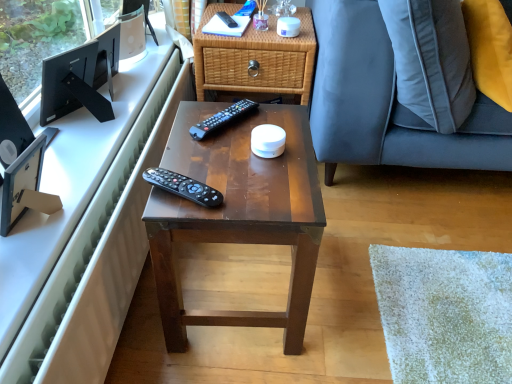
I want to click on empty space that is to the right of black plastic remote control at center, which appears as the second remote control when viewed from the back, so click(x=279, y=124).